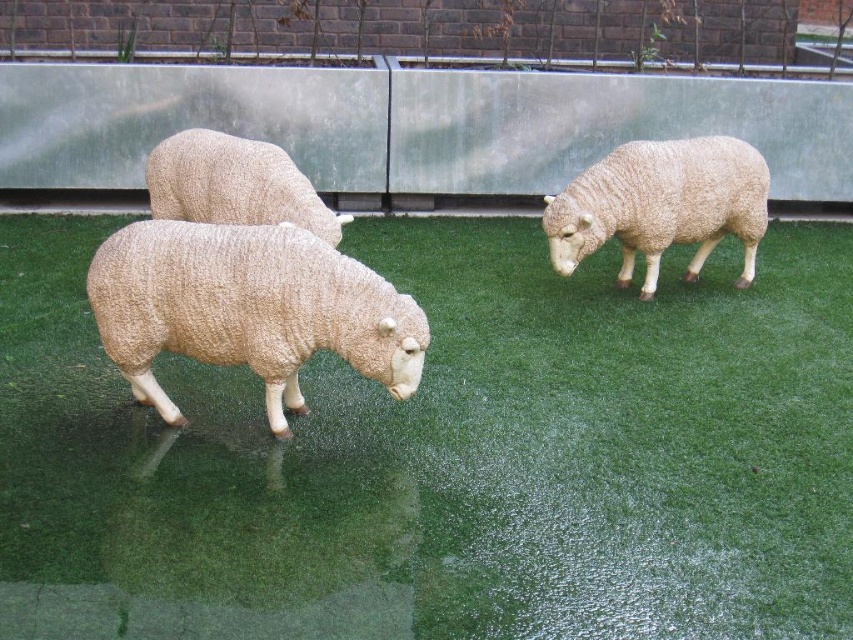
Is point (735, 164) positioned behind point (309, 186)?

Yes, it is behind point (309, 186).

Consider the image. Which is below, white woolen sheep at center or fuzzy woolen sheep at center?

white woolen sheep at center is below.

Where is `white woolen sheep at center`? The image size is (853, 640). white woolen sheep at center is located at coordinates (660, 205).

Can you confirm if green artificial grass at center is thinner than white woolen sheep at center?

In fact, green artificial grass at center might be wider than white woolen sheep at center.

Which of these two, green artificial grass at center or white woolen sheep at center, stands taller?

green artificial grass at center is taller.

Which is in front, point (672, 362) or point (691, 150)?

Point (672, 362) is more forward.

Locate an element on the screen. The height and width of the screenshot is (640, 853). green artificial grass at center is located at coordinates (445, 456).

Who is taller, white woolen sheep at left or fuzzy woolen sheep at center?

white woolen sheep at left is taller.

Who is higher up, white woolen sheep at left or fuzzy woolen sheep at center?

Positioned higher is fuzzy woolen sheep at center.

Between point (405, 352) and point (204, 189), which one is positioned in front?

Point (405, 352)

Locate an element on the screen. This screenshot has height=640, width=853. white woolen sheep at left is located at coordinates (247, 308).